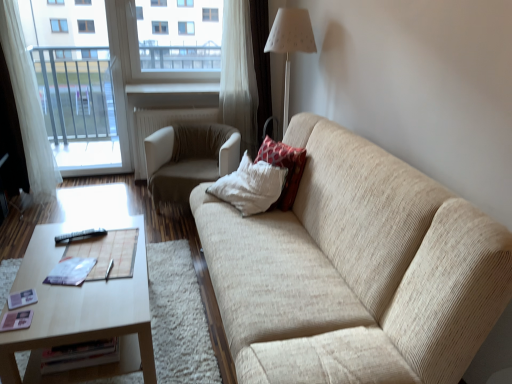
This screenshot has height=384, width=512. I want to click on vacant area that is situated to the right of light brown wooden coffee table at lower left, so click(179, 335).